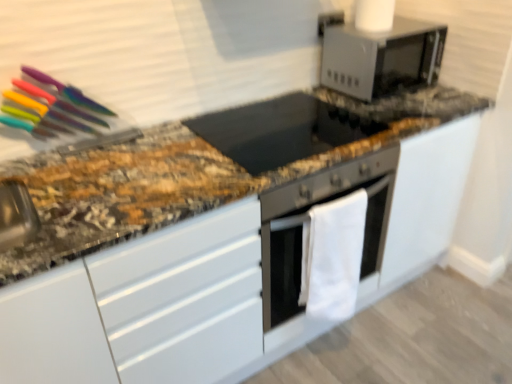
Question: From a real-world perspective, is satin silver microwave at upper right located beneath white fabric oven at center?

Choices:
 (A) yes
 (B) no

Answer: (B)

Question: Considering the relative positions of satin silver microwave at upper right and white fabric oven at center in the image provided, is satin silver microwave at upper right behind white fabric oven at center?

Choices:
 (A) no
 (B) yes

Answer: (B)

Question: Does satin silver microwave at upper right turn towards white fabric oven at center?

Choices:
 (A) no
 (B) yes

Answer: (A)

Question: Is satin silver microwave at upper right next to white fabric oven at center and touching it?

Choices:
 (A) no
 (B) yes

Answer: (A)

Question: Is satin silver microwave at upper right at the left side of white fabric oven at center?

Choices:
 (A) yes
 (B) no

Answer: (B)

Question: Looking at their shapes, would you say black glass cooktop at center is wider or thinner than satin silver microwave at upper right?

Choices:
 (A) wide
 (B) thin

Answer: (A)

Question: Is black glass cooktop at center in front of or behind satin silver microwave at upper right in the image?

Choices:
 (A) front
 (B) behind

Answer: (A)

Question: From the image's perspective, is black glass cooktop at center above or below satin silver microwave at upper right?

Choices:
 (A) above
 (B) below

Answer: (B)

Question: Based on their sizes in the image, would you say black glass cooktop at center is bigger or smaller than satin silver microwave at upper right?

Choices:
 (A) small
 (B) big

Answer: (A)

Question: From a real-world perspective, relative to white fabric oven at center, is black glass cooktop at center vertically above or below?

Choices:
 (A) above
 (B) below

Answer: (A)

Question: Considering the positions of black glass cooktop at center and white fabric oven at center in the image, is black glass cooktop at center taller or shorter than white fabric oven at center?

Choices:
 (A) tall
 (B) short

Answer: (B)

Question: Based on their positions, is black glass cooktop at center located to the left or right of white fabric oven at center?

Choices:
 (A) left
 (B) right

Answer: (A)

Question: From the image's perspective, is black glass cooktop at center positioned above or below white fabric oven at center?

Choices:
 (A) below
 (B) above

Answer: (B)

Question: Is satin silver microwave at upper right to the left or to the right of white fabric oven at center in the image?

Choices:
 (A) left
 (B) right

Answer: (B)

Question: Is satin silver microwave at upper right in front of or behind white fabric oven at center in the image?

Choices:
 (A) front
 (B) behind

Answer: (B)